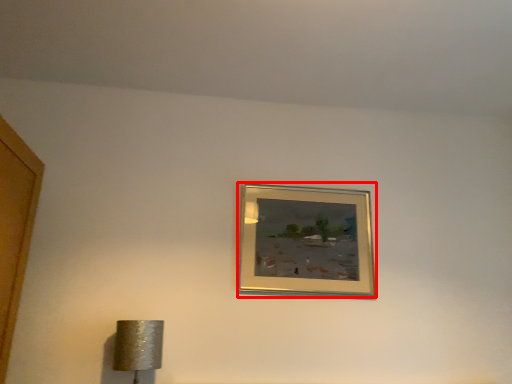
Question: From the image's perspective, where is picture frame (annotated by the red box) located in relation to lamp in the image?

Choices:
 (A) above
 (B) below

Answer: (A)